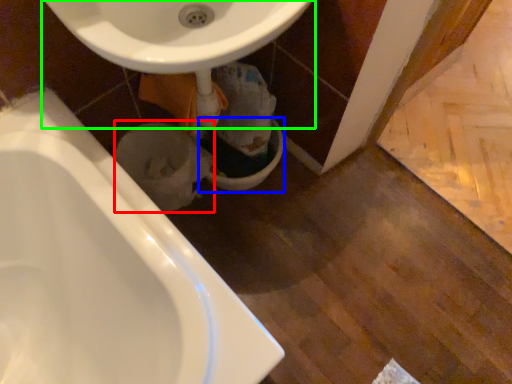
Question: Which object is positioned closest to toilet bowl (highlighted by a red box)? Select from toilet bowl (highlighted by a blue box) and sink (highlighted by a green box).

Choices:
 (A) toilet bowl
 (B) sink

Answer: (A)